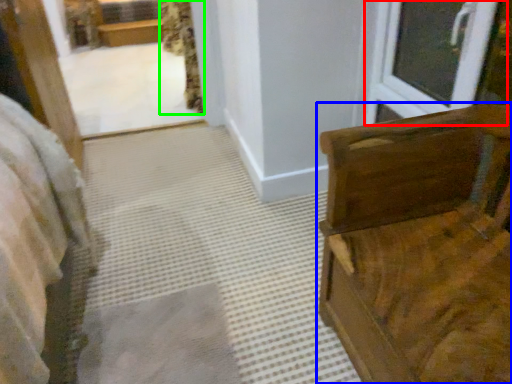
Question: Considering the real-world distances, which object is closest to window (highlighted by a red box)? furniture (highlighted by a blue box) or curtain (highlighted by a green box).

Choices:
 (A) furniture
 (B) curtain

Answer: (A)